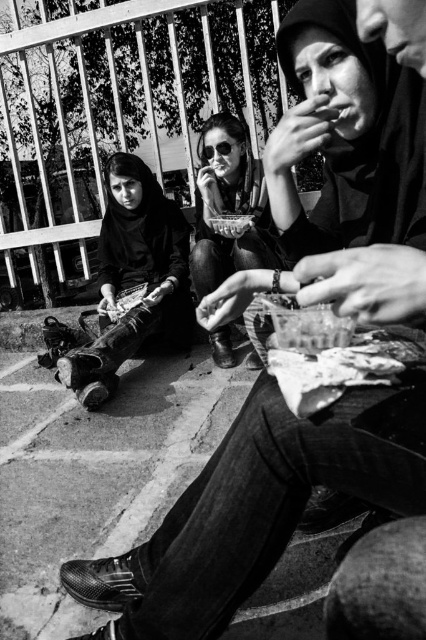
Question: Where is matte black clothing at center located in relation to sunglasses at center in the image?

Choices:
 (A) below
 (B) above

Answer: (A)

Question: Considering the relative positions of matte black clothing at center and sunglasses at center in the image provided, where is matte black clothing at center located with respect to sunglasses at center?

Choices:
 (A) right
 (B) left

Answer: (B)

Question: Which object appears closest to the camera in this image?

Choices:
 (A) sunglasses at center
 (B) matte black clothing at center

Answer: (A)

Question: Which point is closer to the camera?

Choices:
 (A) (241, 140)
 (B) (114, 182)

Answer: (A)

Question: Does matte black clothing at center have a greater width compared to sunglasses at center?

Choices:
 (A) no
 (B) yes

Answer: (B)